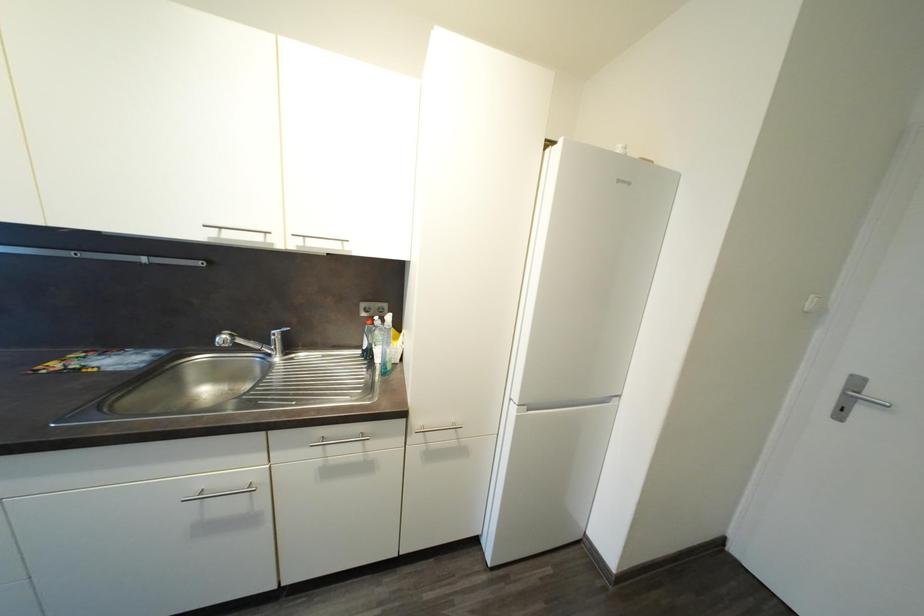
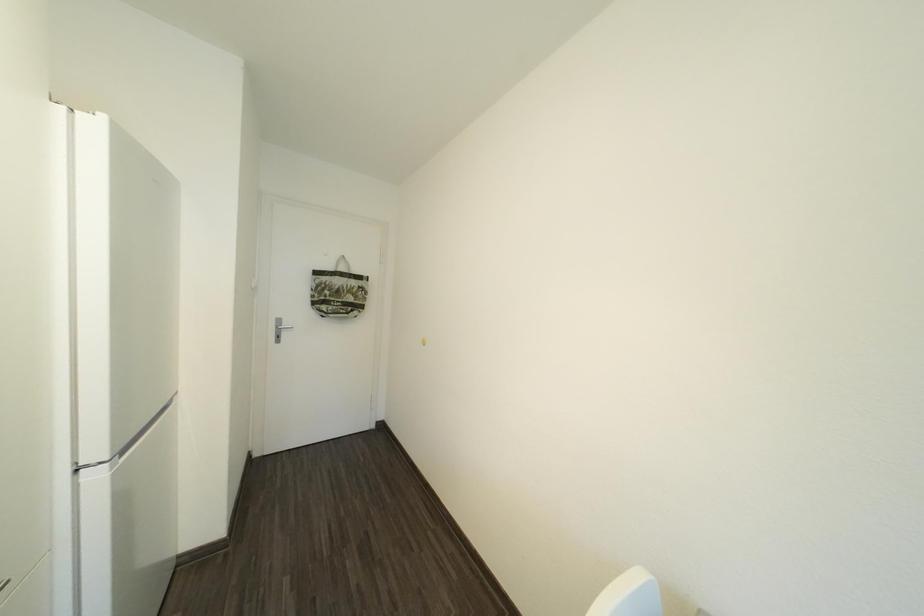
Question: The camera is either moving clockwise (left) or counter-clockwise (right) around the object. The first image is from the beginning of the video and the second image is from the end. Is the camera moving left or right when shooting the video?

Choices:
 (A) Left
 (B) Right

Answer: (A)